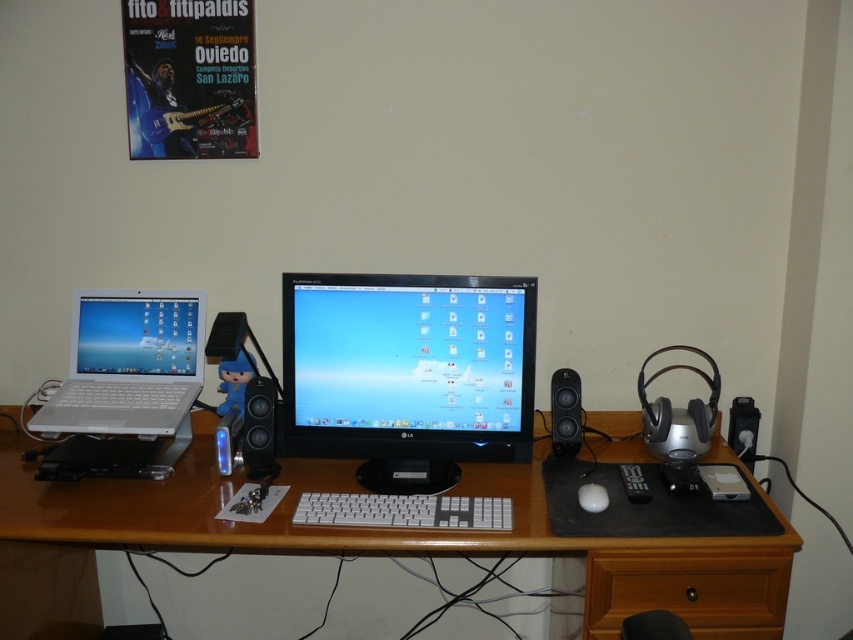
Question: Which is nearer to the white plastic keyboard at center?

Choices:
 (A) matte black speaker at center
 (B) black plastic speaker at right
 (C) matte white laptop at left

Answer: (A)

Question: Is white plastic keyboard at center bigger than white matte mouse at center?

Choices:
 (A) no
 (B) yes

Answer: (B)

Question: Among these points, which one is nearest to the camera?

Choices:
 (A) (599, 586)
 (B) (253, 464)

Answer: (A)

Question: Is white plastic keyboard at center bigger than black plastic speaker at right?

Choices:
 (A) yes
 (B) no

Answer: (B)

Question: Is matte white laptop at left to the left of white plastic keyboard at center from the viewer's perspective?

Choices:
 (A) yes
 (B) no

Answer: (A)

Question: Estimate the real-world distances between objects in this image. Which object is farther from the white plastic keyboard at center?

Choices:
 (A) matte black speaker at center
 (B) white plastic laptop at left

Answer: (B)